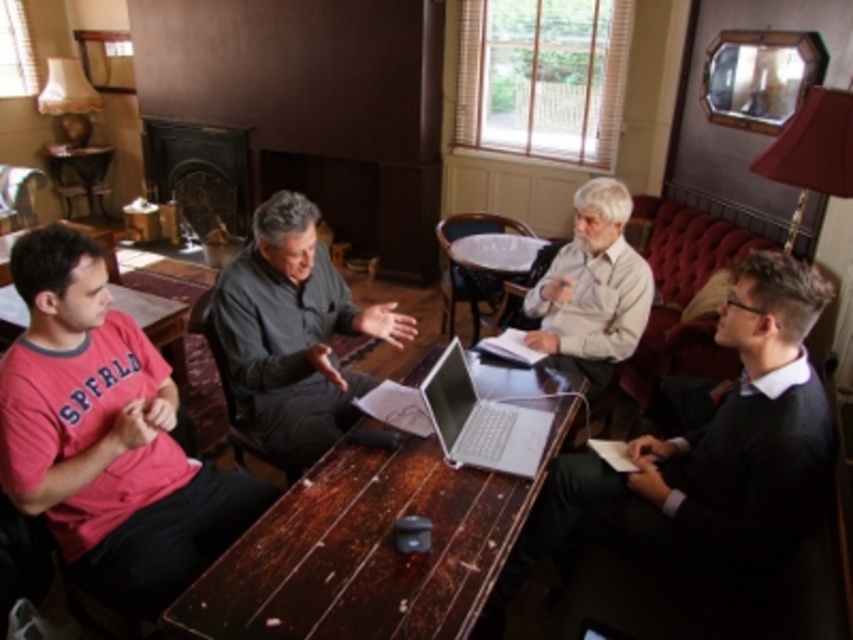
Consider the image. Which is more to the left, dark gray sweater at right or dark gray shirt at center?

dark gray shirt at center

Does dark gray sweater at right have a lesser width compared to dark gray shirt at center?

No, dark gray sweater at right is not thinner than dark gray shirt at center.

What do you see at coordinates (706, 452) in the screenshot?
I see `dark gray sweater at right` at bounding box center [706, 452].

Where is `dark gray sweater at right`? The image size is (853, 640). dark gray sweater at right is located at coordinates (706, 452).

Does matte pink t-shirt at left have a smaller size compared to wooden table at center?

Yes.

Is matte pink t-shirt at left positioned at the back of wooden table at center?

That is True.

Locate an element on the screen. matte pink t-shirt at left is located at coordinates click(107, 436).

Between point (349, 454) and point (489, 612), which one is positioned in front?

Point (349, 454) is in front.

Where is `wooden table at center`? This screenshot has height=640, width=853. wooden table at center is located at coordinates (367, 548).